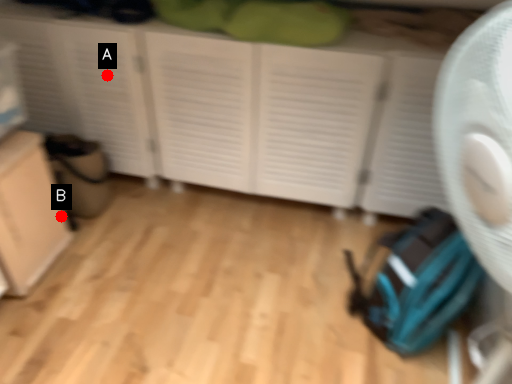
Question: Two points are circled on the image, labeled by A and B beside each circle. Among these points, which one is farthest from the camera?

Choices:
 (A) A is further
 (B) B is further

Answer: (A)